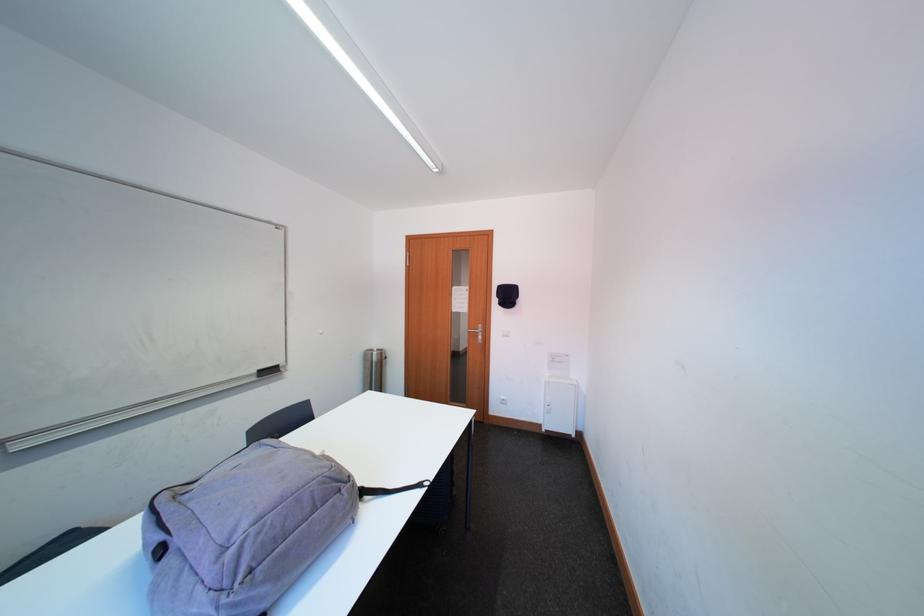
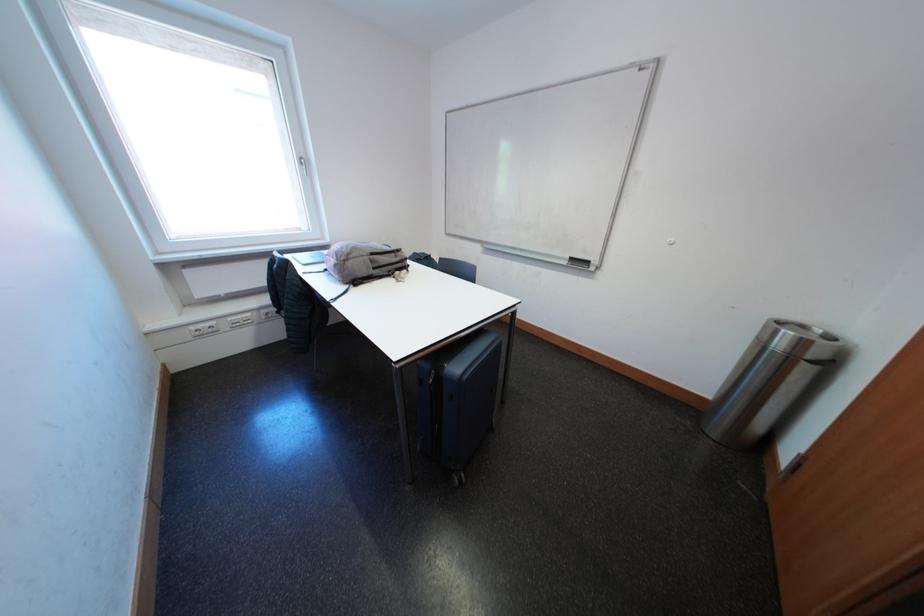
Find the pixel in the second image that matches point (264, 382) in the first image.

(575, 267)